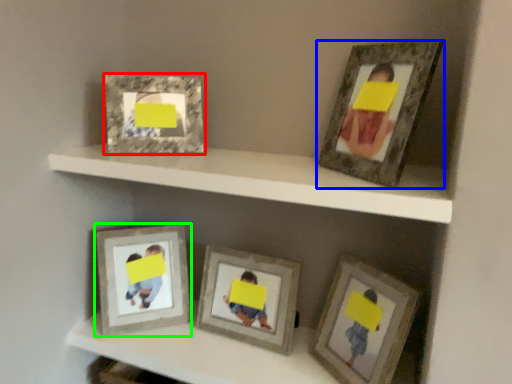
Question: Based on their relative distances, which object is farther from picture frame (highlighted by a red box)? Choose from picture frame (highlighted by a blue box) and picture frame (highlighted by a green box).

Choices:
 (A) picture frame
 (B) picture frame

Answer: (A)